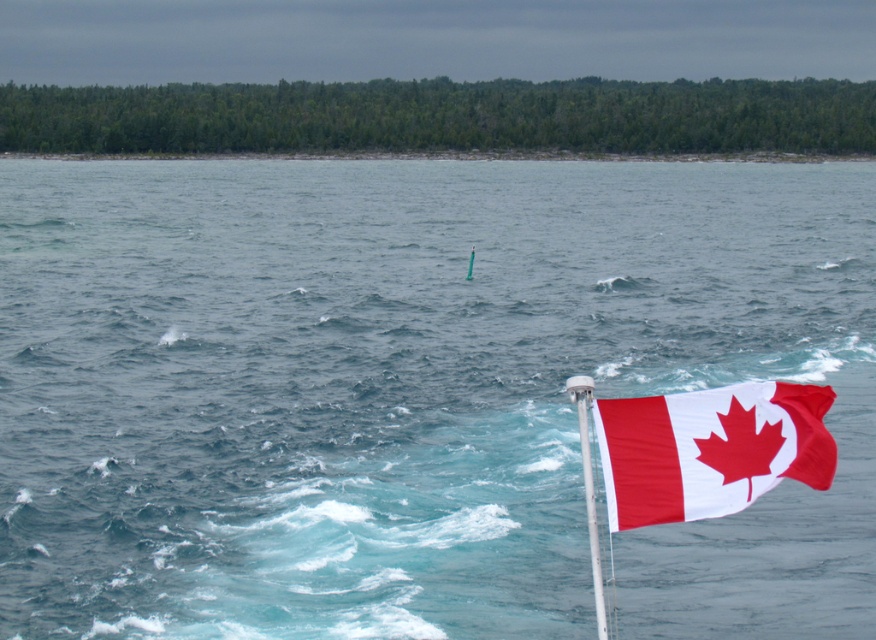
Between point (761, 404) and point (583, 472), which one is positioned behind?

The point (583, 472) is behind.

Between red fabric maple leaf flag at right and white plastic pole at right, which one is positioned higher?

red fabric maple leaf flag at right is above.

Describe the element at coordinates (710, 449) in the screenshot. The width and height of the screenshot is (876, 640). I see `red fabric maple leaf flag at right` at that location.

Locate an element on the screen. The width and height of the screenshot is (876, 640). red fabric maple leaf flag at right is located at coordinates point(710,449).